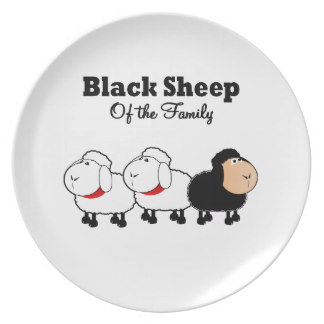
Identify the location of white plate. (221, 259), (261, 122), (195, 133), (113, 135).